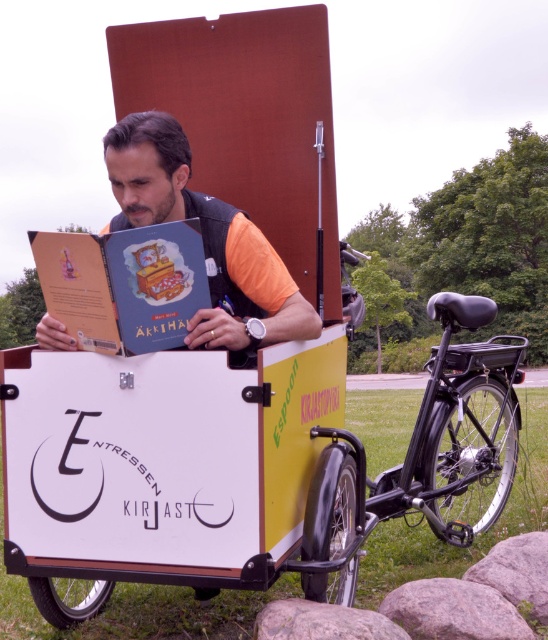
You are a librarian who needs to place both the matte black book at center and the hardcover book at center on a shelf that can only hold items up to the size of the bigger one. Which book should you use as the size reference?

The matte black book at center is bigger than the hardcover book at center, so you should use the matte black book at center as the size reference to ensure the shelf can accommodate both books.

You are a delivery person who needs to deliver a package to the library. You see the black matte bicycle at center and the hardcover book at center. Which object is closer to your right side?

The black matte bicycle at center is to the right of the hardcover book at center, so it is closer to your right side.

You are a librarian who needs to retrieve a book from the cargo bike trailer. You see the matte black book at center and the hardcover book at center. Which book is closer to you?

The matte black book at center is closer to you because the hardcover book at center is behind it.